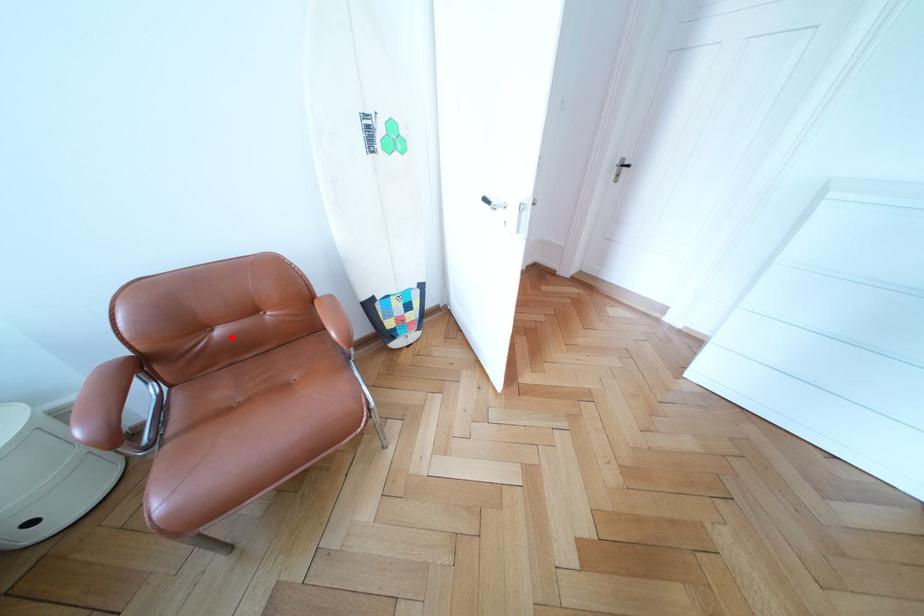
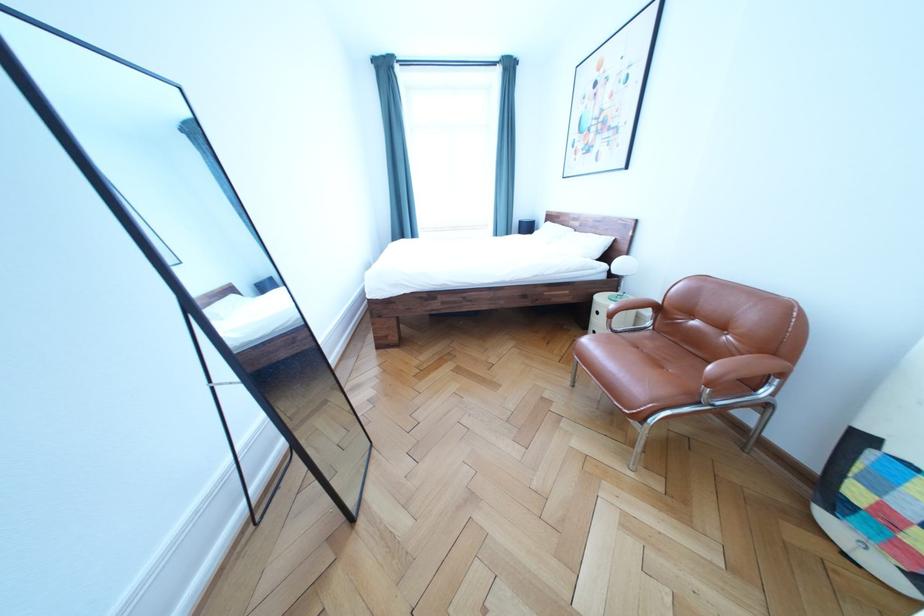
Locate, in the second image, the point that corresponds to the highlighted location in the first image.

(706, 329)